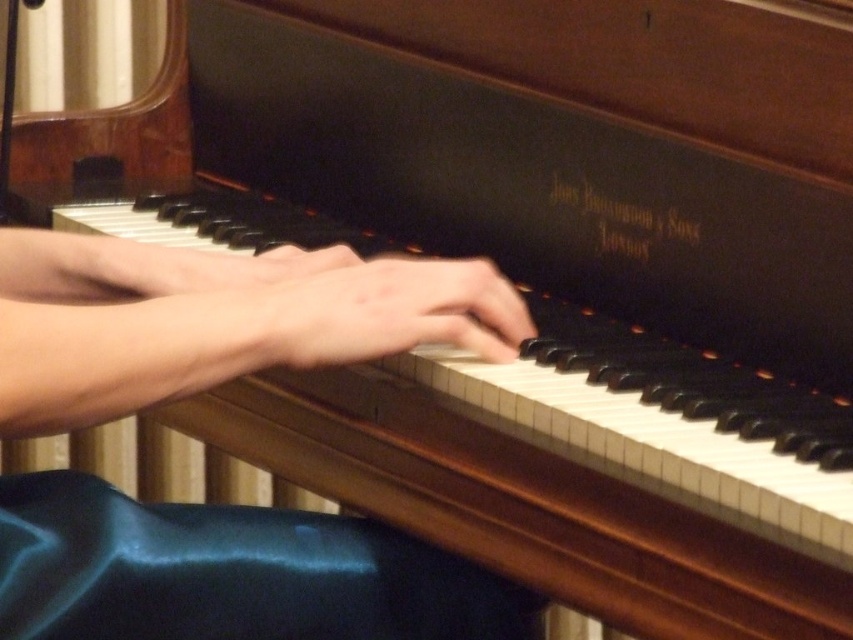
Question: Which of the following is the closest to the observer?

Choices:
 (A) smooth skin hand at center
 (B) smooth skin hands at center

Answer: (B)

Question: Which object is closer to the camera taking this photo?

Choices:
 (A) smooth skin hand at center
 (B) smooth skin hands at center

Answer: (B)

Question: Does smooth skin hands at center have a greater width compared to smooth skin hand at center?

Choices:
 (A) yes
 (B) no

Answer: (A)

Question: Can you confirm if smooth skin hands at center is positioned to the right of smooth skin hand at center?

Choices:
 (A) yes
 (B) no

Answer: (B)

Question: Can you confirm if smooth skin hands at center is thinner than smooth skin hand at center?

Choices:
 (A) yes
 (B) no

Answer: (B)